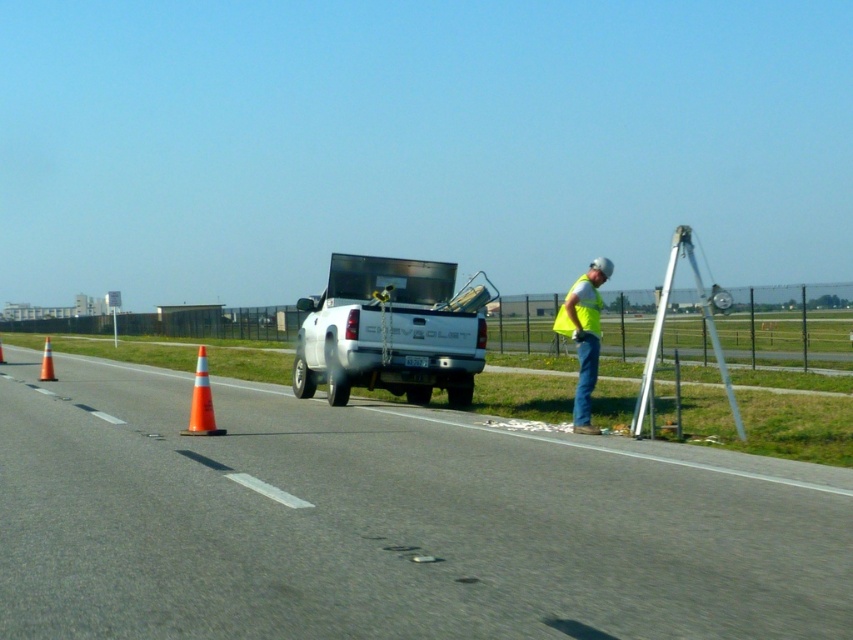
Question: Which object is positioned closest to the orange reflective cone at left?

Choices:
 (A) white matte truck bed at center
 (B) orange reflective cone at road center
 (C) yellow reflective vest at center
 (D) orange reflective cone at center-left

Answer: (D)

Question: Does white matte truck bed at center come in front of orange reflective cone at left?

Choices:
 (A) no
 (B) yes

Answer: (B)

Question: Can you confirm if asphalt road at center is positioned to the left of white matte truck bed at center?

Choices:
 (A) no
 (B) yes

Answer: (B)

Question: Estimate the real-world distances between objects in this image. Which object is closer to the white matte truck bed at center?

Choices:
 (A) orange reflective cone at left
 (B) asphalt road at center
 (C) yellow reflective vest at center
 (D) orange reflective cone at road center

Answer: (B)

Question: Can you confirm if white matte truck bed at center is wider than orange reflective cone at center-left?

Choices:
 (A) yes
 (B) no

Answer: (A)

Question: Which object appears farthest from the camera in this image?

Choices:
 (A) asphalt road at center
 (B) orange reflective cone at center-left

Answer: (B)